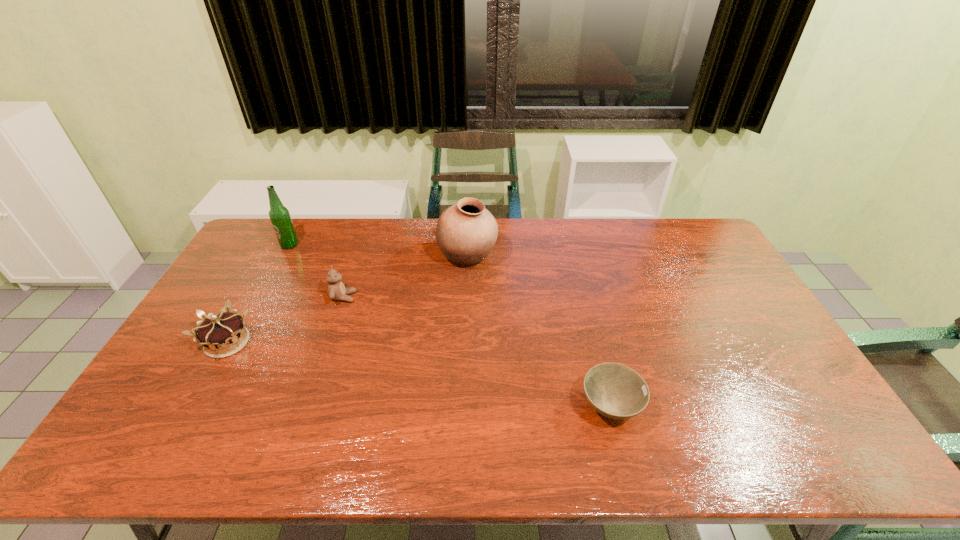
Where is `beer bottle`? Image resolution: width=960 pixels, height=540 pixels. beer bottle is located at coordinates (279, 215).

Where is `the second object from right to left`? The image size is (960, 540). the second object from right to left is located at coordinates (466, 232).

This screenshot has height=540, width=960. What are the coordinates of `the third object from left to right` in the screenshot? It's located at (337, 291).

Find the location of a particular element. This screenshot has height=540, width=960. the third farthest object is located at coordinates (337, 291).

At what (x,y) coordinates should I click in order to perform the action: click on crown. Please return your answer as a coordinate pair (x, y). Looking at the image, I should click on (221, 335).

You are a GUI agent. You are given a task and a screenshot of the screen. Output one action in this format:
    pyautogui.click(x=<x>, y=<y>)
    Task: Click on the rightmost object
    Image resolution: width=960 pixels, height=540 pixels.
    Given the screenshot: What is the action you would take?
    pyautogui.click(x=616, y=391)

Where is `the shortest object`? The height and width of the screenshot is (540, 960). the shortest object is located at coordinates (616, 391).

At what (x,y) coordinates should I click in order to perform the action: click on vacant space located 0.180m on the label of the beer bottle. Please return your answer as a coordinate pair (x, y). The width and height of the screenshot is (960, 540). Looking at the image, I should click on (269, 284).

Image resolution: width=960 pixels, height=540 pixels. I want to click on vacant space located on the left of the pottery, so click(x=337, y=258).

Where is `vacant space located on the front-facing side of the third nearest object`? This screenshot has width=960, height=540. vacant space located on the front-facing side of the third nearest object is located at coordinates (448, 297).